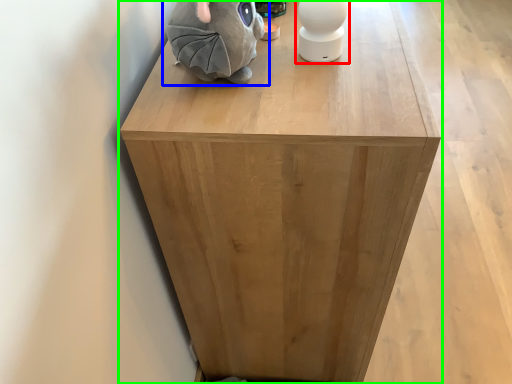
Question: Estimate the real-world distances between objects in this image. Which object is farther from toy (highlighted by a red box), toy (highlighted by a blue box) or furniture (highlighted by a green box)?

Choices:
 (A) toy
 (B) furniture

Answer: (B)